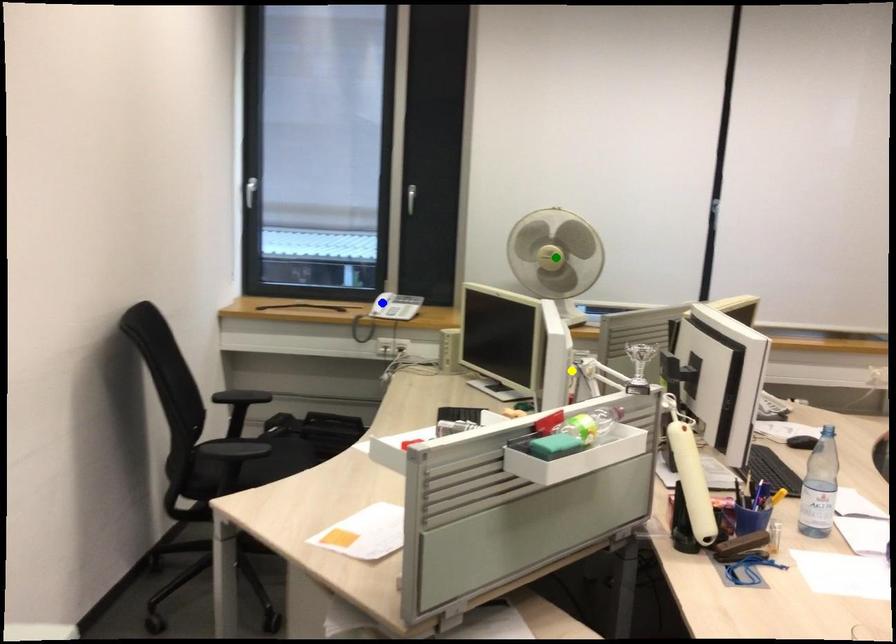
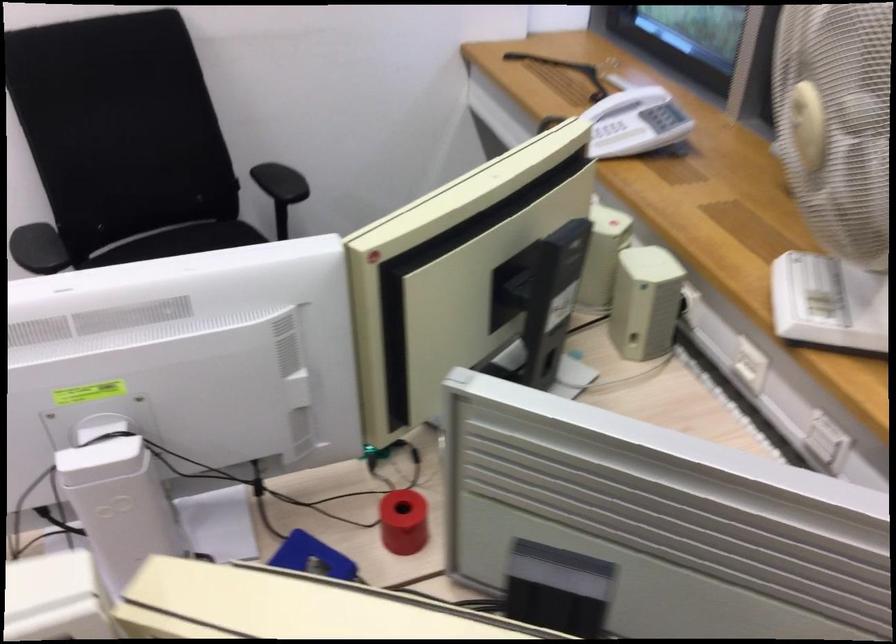
I am providing you with two images of the same scene from different viewpoints. Three points are marked in image1. Which point corresponds to a part or object that is occluded in image2?In image1, three points are marked. Which of them correspond to a part or object that is occluded in image2?Among the three points shown in image1, which one corresponds to a part or object that is no longer visible due to occlusion in image2?

green point cannot be seen in image2.